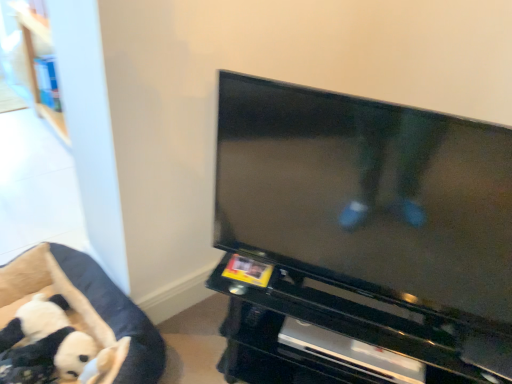
Question: Is black plush toy at lower left taller or shorter than black glossy entertainment center at center?

Choices:
 (A) short
 (B) tall

Answer: (A)

Question: Based on their positions, is black plush toy at lower left located to the left or right of black glossy entertainment center at center?

Choices:
 (A) left
 (B) right

Answer: (A)

Question: Estimate the real-world distances between objects in this image. Which object is farther from the black glossy entertainment center at center?

Choices:
 (A) black glossy tv at center
 (B) soft plush dog bed at lower left
 (C) black plush toy at lower left

Answer: (C)

Question: Estimate the real-world distances between objects in this image. Which object is farther from the soft plush dog bed at lower left?

Choices:
 (A) black glossy entertainment center at center
 (B) black plush toy at lower left
 (C) black glossy tv at center

Answer: (C)